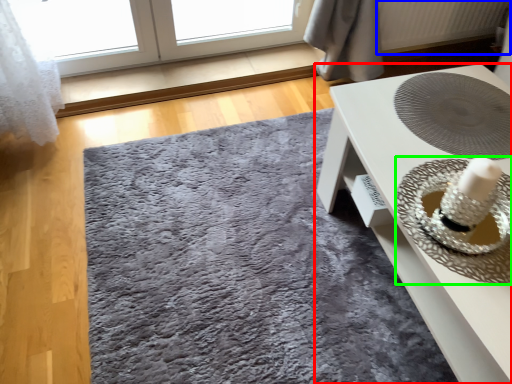
Question: Which object is the farthest from table (highlighted by a red box)? Choose among these: radiator (highlighted by a blue box) or straw hat (highlighted by a green box).

Choices:
 (A) radiator
 (B) straw hat

Answer: (A)